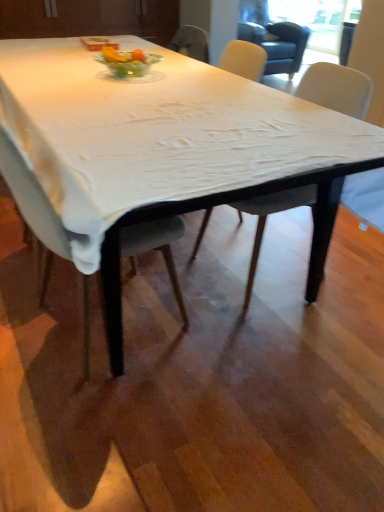
Question: Is transparent glass window screen at upper right turned away from matte gray chair at center, which is the 2th chair in right-to-left order?

Choices:
 (A) yes
 (B) no

Answer: (B)

Question: Considering the relative sizes of transparent glass window screen at upper right and matte gray chair at center, which is the 2th chair in right-to-left order, in the image provided, is transparent glass window screen at upper right wider than matte gray chair at center, which is the 2th chair in right-to-left order,?

Choices:
 (A) no
 (B) yes

Answer: (A)

Question: Does transparent glass window screen at upper right lie in front of matte gray chair at center, marked as the 1th chair in a left-to-right arrangement?

Choices:
 (A) yes
 (B) no

Answer: (B)

Question: Is transparent glass window screen at upper right positioned far away from matte gray chair at center, which is the 2th chair in right-to-left order?

Choices:
 (A) yes
 (B) no

Answer: (A)

Question: Is transparent glass window screen at upper right facing towards matte gray chair at center, which is the 2th chair in right-to-left order?

Choices:
 (A) yes
 (B) no

Answer: (B)

Question: Considering the relative sizes of transparent glass window screen at upper right and matte gray chair at center, which is the 2th chair in right-to-left order, in the image provided, is transparent glass window screen at upper right bigger than matte gray chair at center, which is the 2th chair in right-to-left order,?

Choices:
 (A) no
 (B) yes

Answer: (A)

Question: From the image's perspective, is white cloth-covered table at center below clear glass bowl at center?

Choices:
 (A) no
 (B) yes

Answer: (B)

Question: Is white cloth-covered table at center facing away from clear glass bowl at center?

Choices:
 (A) yes
 (B) no

Answer: (B)

Question: From a real-world perspective, is white cloth-covered table at center located higher than clear glass bowl at center?

Choices:
 (A) no
 (B) yes

Answer: (A)

Question: Considering the relative sizes of white cloth-covered table at center and clear glass bowl at center in the image provided, is white cloth-covered table at center shorter than clear glass bowl at center?

Choices:
 (A) no
 (B) yes

Answer: (A)

Question: Does white cloth-covered table at center have a lesser width compared to clear glass bowl at center?

Choices:
 (A) no
 (B) yes

Answer: (A)

Question: Is clear glass bowl at center surrounded by white cloth-covered table at center?

Choices:
 (A) yes
 (B) no

Answer: (B)

Question: Is matte gray chair at center, marked as the 1th chair in a left-to-right arrangement, not within clear glass bowl at center?

Choices:
 (A) yes
 (B) no

Answer: (A)